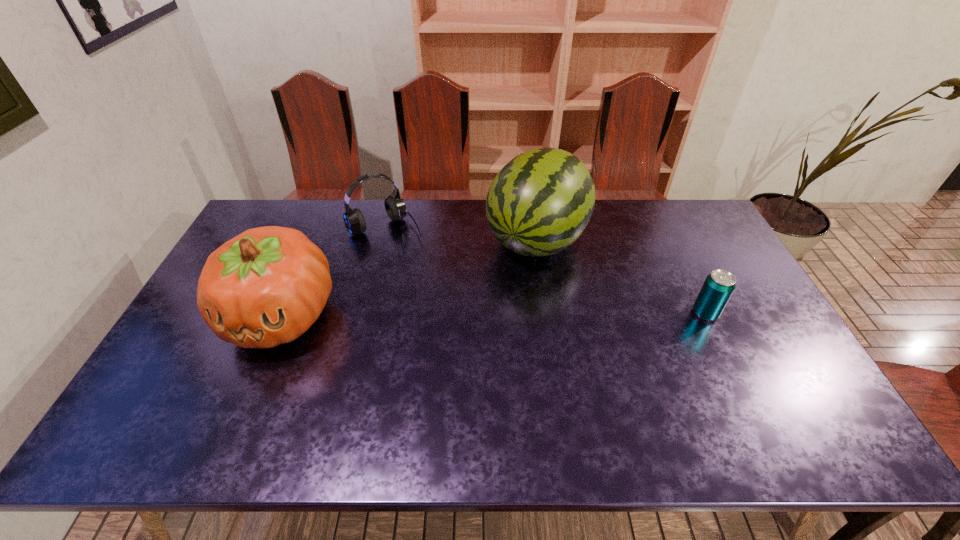
Locate an element on the screen. The height and width of the screenshot is (540, 960). free location located 0.310m at the stem end of the watermelon is located at coordinates (462, 341).

I want to click on vacant point located at the stem end of the watermelon, so click(x=504, y=285).

Where is `headset positioned at the far edge`? The width and height of the screenshot is (960, 540). headset positioned at the far edge is located at coordinates (395, 207).

Where is `watermelon that is at the far edge`? watermelon that is at the far edge is located at coordinates (539, 203).

Locate an element on the screen. The height and width of the screenshot is (540, 960). object that is at the left edge is located at coordinates (265, 287).

Find the location of a particular element. Image resolution: width=960 pixels, height=540 pixels. object at the right edge is located at coordinates (718, 287).

Where is `free spot at the far edge of the desktop`? free spot at the far edge of the desktop is located at coordinates (323, 212).

Locate an element on the screen. This screenshot has height=540, width=960. free spot at the near edge of the desktop is located at coordinates (464, 400).

This screenshot has height=540, width=960. In the image, there is a desktop. Find the location of `free space at the left edge`. free space at the left edge is located at coordinates (188, 331).

Where is `free spot at the far left corner of the desktop`? free spot at the far left corner of the desktop is located at coordinates (289, 221).